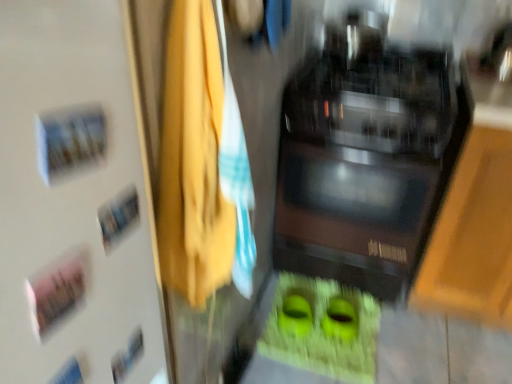
Question: Should I look upward or downward to see black glossy microwave at center?

Choices:
 (A) down
 (B) up

Answer: (B)

Question: Is the surface of white matte door at upper left in direct contact with black glossy microwave at center?

Choices:
 (A) yes
 (B) no

Answer: (B)

Question: From the image's perspective, does white matte door at upper left appear lower than black glossy microwave at center?

Choices:
 (A) yes
 (B) no

Answer: (A)

Question: Does white matte door at upper left lie in front of black glossy microwave at center?

Choices:
 (A) yes
 (B) no

Answer: (A)

Question: Is white matte door at upper left aimed at black glossy microwave at center?

Choices:
 (A) yes
 (B) no

Answer: (B)

Question: Does white matte door at upper left contain black glossy microwave at center?

Choices:
 (A) no
 (B) yes

Answer: (A)

Question: From a real-world perspective, is white matte door at upper left located higher than black glossy microwave at center?

Choices:
 (A) yes
 (B) no

Answer: (A)

Question: From a real-world perspective, is black glossy microwave at center below yellow fabric at center?

Choices:
 (A) no
 (B) yes

Answer: (B)

Question: Does black glossy microwave at center lie in front of yellow fabric at center?

Choices:
 (A) yes
 (B) no

Answer: (B)

Question: Is black glossy microwave at center not close to yellow fabric at center?

Choices:
 (A) no
 (B) yes

Answer: (A)

Question: Is black glossy microwave at center bigger than yellow fabric at center?

Choices:
 (A) yes
 (B) no

Answer: (A)

Question: Can you confirm if black glossy microwave at center is shorter than yellow fabric at center?

Choices:
 (A) no
 (B) yes

Answer: (A)

Question: Is black glossy microwave at center smaller than yellow fabric at center?

Choices:
 (A) no
 (B) yes

Answer: (A)

Question: Would you consider yellow fabric at center to be distant from black glossy microwave at center?

Choices:
 (A) yes
 (B) no

Answer: (B)